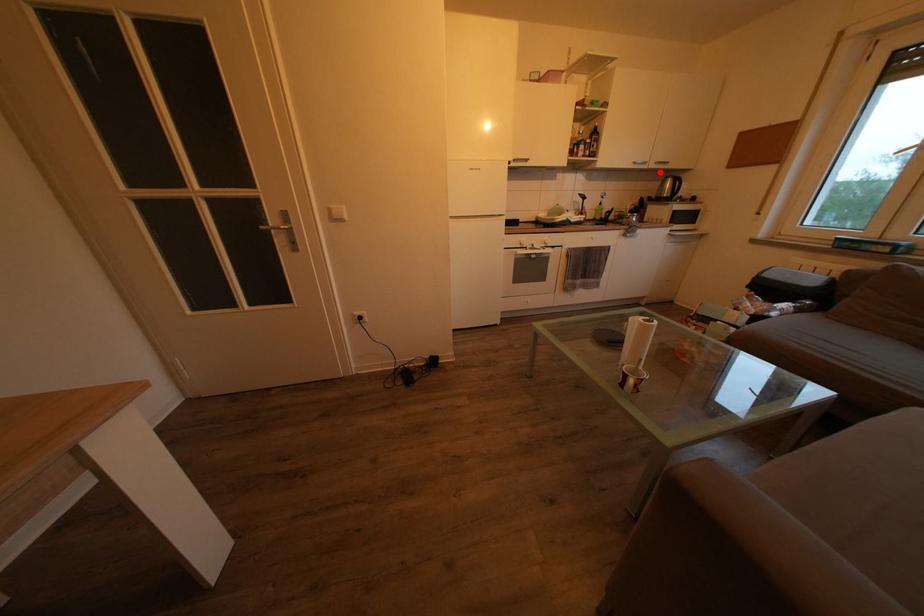
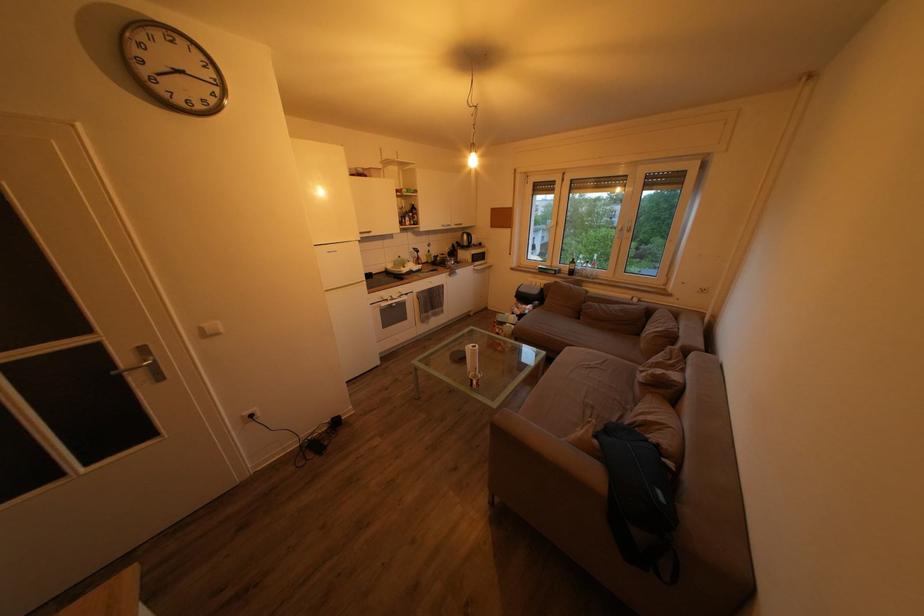
Question: I am providing you with two images of the same scene from different viewpoints. A red point is marked on the first image. Is the red point's position out of view in image 2?

Choices:
 (A) Yes
 (B) No

Answer: (B)